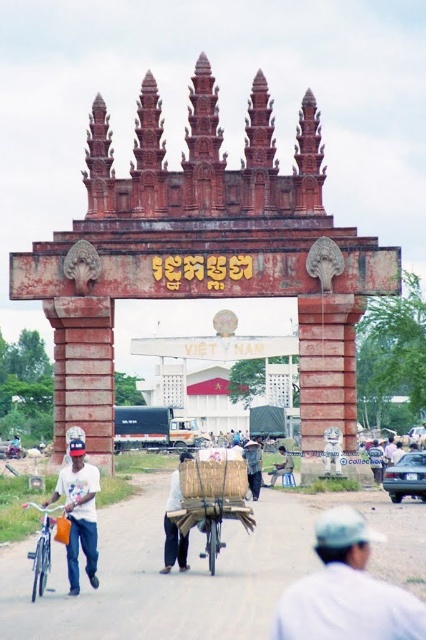
Between white cloth hat at lower right and blue denim pants at center, which one is positioned higher?

blue denim pants at center

Does white cloth hat at lower right have a lesser width compared to blue denim pants at center?

No.

Locate an element on the screen. Image resolution: width=426 pixels, height=640 pixels. white cloth hat at lower right is located at coordinates (347, 589).

Does white cloth hat at lower right come behind denim pants at center?

No, it is not.

What do you see at coordinates (347, 589) in the screenshot? I see `white cloth hat at lower right` at bounding box center [347, 589].

Locate an element on the screen. This screenshot has height=640, width=426. white cloth hat at lower right is located at coordinates (347, 589).

Is white matte shirt at center taller than denim pants at center?

Correct, white matte shirt at center is much taller as denim pants at center.

Who is more distant from viewer, (77, 547) or (255, 477)?

The point (255, 477) is behind.

Which is behind, point (68, 566) or point (250, 486)?

The point (250, 486) is more distant.

The width and height of the screenshot is (426, 640). Find the location of `white matte shirt at center`. white matte shirt at center is located at coordinates (78, 513).